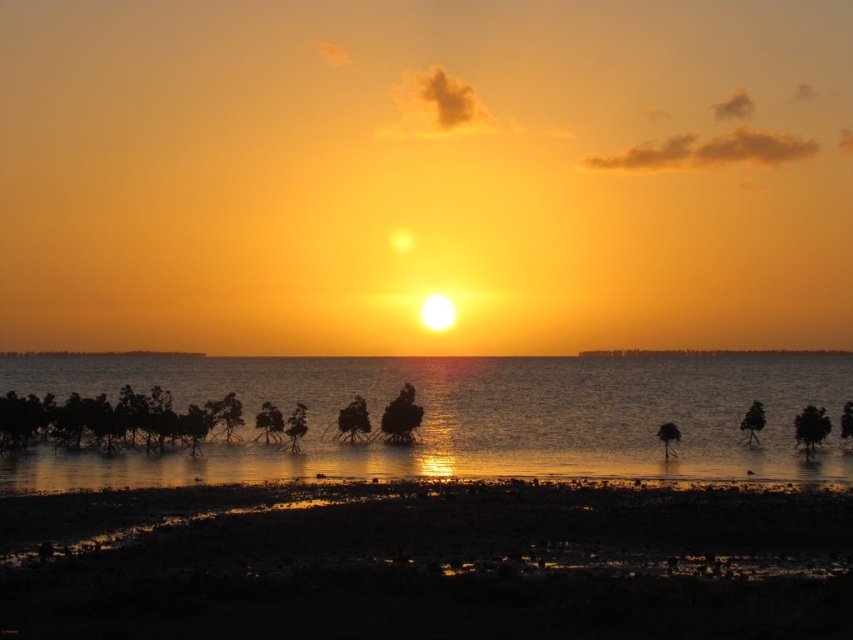
Can you confirm if damp sand at lower center is smaller than silvery reflective water at center?

Correct, damp sand at lower center occupies less space than silvery reflective water at center.

Is damp sand at lower center positioned before silvery reflective water at center?

Yes, damp sand at lower center is closer to the viewer.

Which is in front, point (733, 538) or point (155, 362)?

Point (733, 538) is more forward.

Locate an element on the screen. damp sand at lower center is located at coordinates (428, 563).